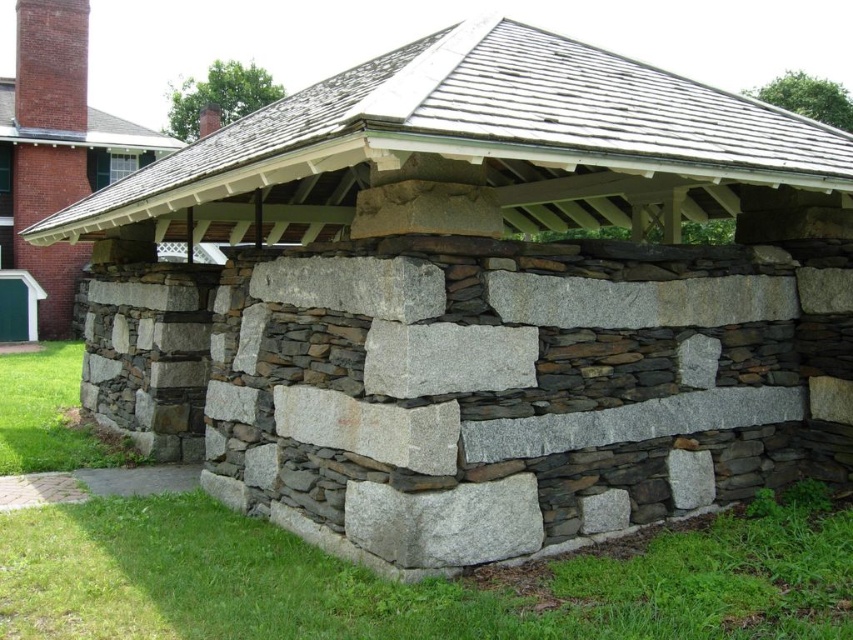
You are standing in front of the rustic stone structure and want to touch both point (357, 566) and point (10, 163). Which point should you reach for first to touch the closer one?

Point (357, 566) is closer to you than point (10, 163), so you should reach for point (357, 566) first.

You are standing in front of the rustic stone structure and want to place a small potted plant. You have two options to place it either on the green grass at lower center or on the natural stone wall at lower left. Which location is physically closer to you where you can place the potted plant?

The green grass at lower center is closer to the viewer than the natural stone wall at lower left, so you can place the potted plant there as it is nearer to your current position.

You are standing at the base of the natural stone wall at lower left and want to walk towards the green grass at lower center. Which direction should you face to move towards the grass?

You should face away from the natural stone wall at lower left towards the green grass at lower center since the grass is located at the lower center of the scene, which is in front of the wall.